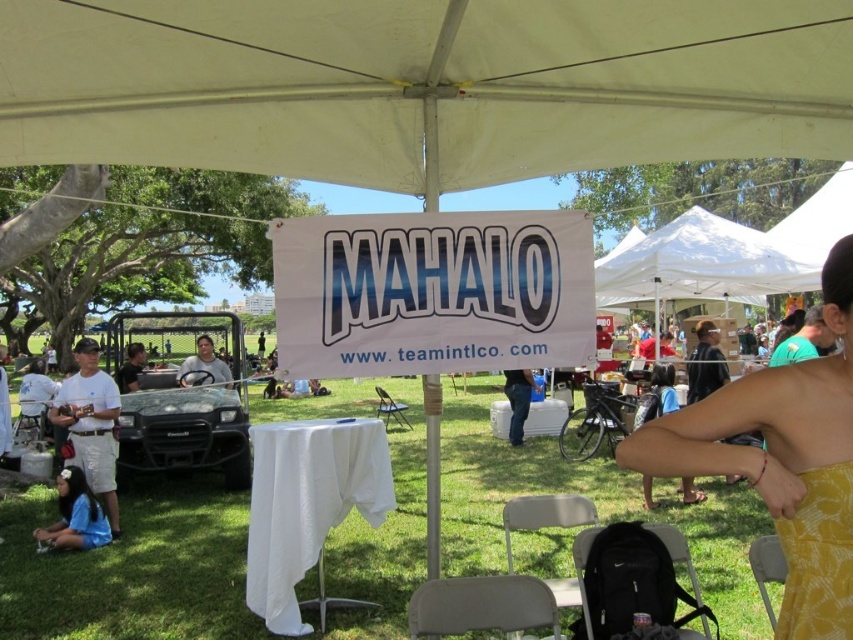
Question: Which of these objects is positioned closest to the white fabric tent at upper center?

Choices:
 (A) white fabric canopy at upper center
 (B) matte black golf cart at center

Answer: (B)

Question: Is white paper banner at center below matte black golf cart at center?

Choices:
 (A) yes
 (B) no

Answer: (B)

Question: Which of these objects is positioned closest to the yellow printed dress at lower right?

Choices:
 (A) yellow dress at center
 (B) matte black golf cart at center
 (C) white cotton shirt at left
 (D) white fabric tent at upper center

Answer: (A)

Question: Which object appears farthest from the camera in this image?

Choices:
 (A) white paper banner at center
 (B) white fabric canopy at upper center
 (C) blue fabric shirt at lower left
 (D) jeans at center

Answer: (D)

Question: Is white fabric tent at upper center positioned in front of white cotton shirt at left?

Choices:
 (A) yes
 (B) no

Answer: (B)

Question: Is the position of white fabric canopy at upper center less distant than that of yellow dress at center?

Choices:
 (A) no
 (B) yes

Answer: (A)